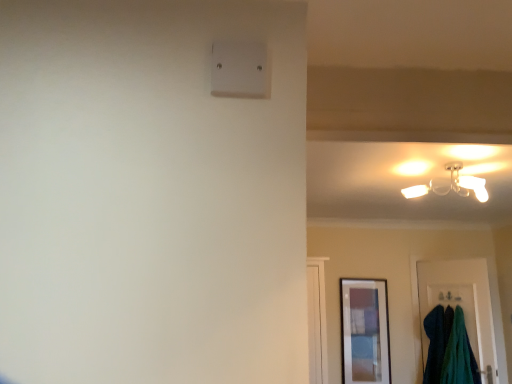
Question: Is matte white ceiling light at upper right bigger than velvety teal towels at lower right?

Choices:
 (A) no
 (B) yes

Answer: (A)

Question: Is matte white ceiling light at upper right taller than velvety teal towels at lower right?

Choices:
 (A) yes
 (B) no

Answer: (B)

Question: From the image's perspective, is matte white ceiling light at upper right beneath velvety teal towels at lower right?

Choices:
 (A) yes
 (B) no

Answer: (B)

Question: Would you say matte white ceiling light at upper right contains velvety teal towels at lower right?

Choices:
 (A) no
 (B) yes

Answer: (A)

Question: Does matte white ceiling light at upper right appear on the left side of velvety teal towels at lower right?

Choices:
 (A) yes
 (B) no

Answer: (A)

Question: Considering the relative sizes of matte white ceiling light at upper right and velvety teal towels at lower right in the image provided, is matte white ceiling light at upper right thinner than velvety teal towels at lower right?

Choices:
 (A) yes
 (B) no

Answer: (B)

Question: Is white plastic light switch at upper center completely or partially outside of teal fabric door at lower right?

Choices:
 (A) yes
 (B) no

Answer: (A)

Question: Is white plastic light switch at upper center looking in the opposite direction of teal fabric door at lower right?

Choices:
 (A) yes
 (B) no

Answer: (B)

Question: Is white plastic light switch at upper center oriented towards teal fabric door at lower right?

Choices:
 (A) yes
 (B) no

Answer: (B)

Question: Does white plastic light switch at upper center have a smaller size compared to teal fabric door at lower right?

Choices:
 (A) yes
 (B) no

Answer: (A)

Question: Does white plastic light switch at upper center have a greater width compared to teal fabric door at lower right?

Choices:
 (A) no
 (B) yes

Answer: (A)

Question: Can you confirm if white plastic light switch at upper center is positioned to the right of teal fabric door at lower right?

Choices:
 (A) no
 (B) yes

Answer: (A)

Question: From the image's perspective, is teal fabric door at lower right on matte white ceiling light at upper right?

Choices:
 (A) no
 (B) yes

Answer: (A)